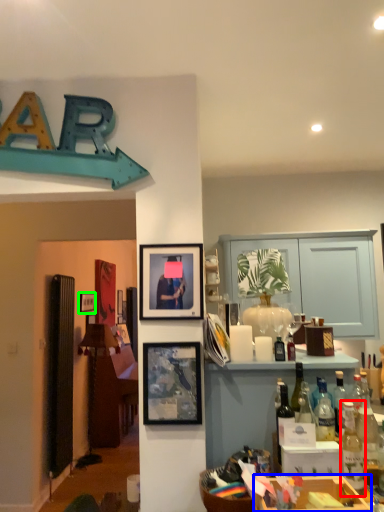
Question: Which object is positioned farthest from bottle (highlighted by a red box)? Select from cabinetry (highlighted by a blue box) and picture frame (highlighted by a green box).

Choices:
 (A) cabinetry
 (B) picture frame

Answer: (B)